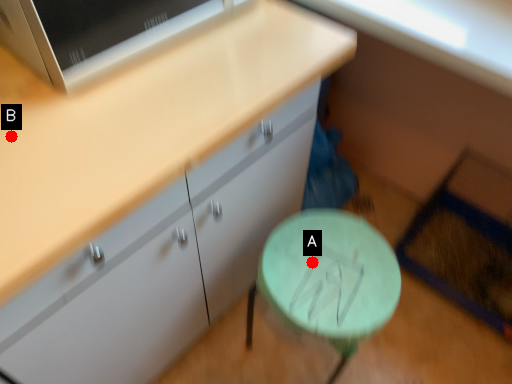
Question: Two points are circled on the image, labeled by A and B beside each circle. Among these points, which one is nearest to the camera?

Choices:
 (A) A is closer
 (B) B is closer

Answer: (B)